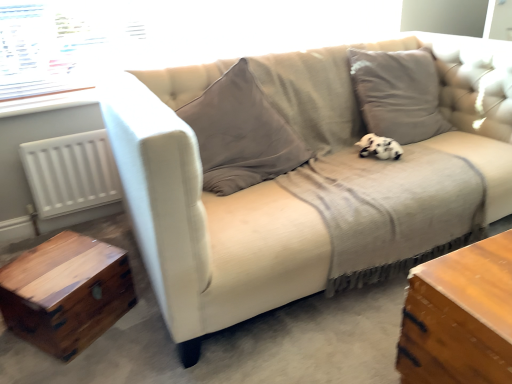
Question: Based on their sizes in the image, would you say transparent glass window at upper left is bigger or smaller than white matte radiator at left?

Choices:
 (A) small
 (B) big

Answer: (B)

Question: Is transparent glass window at upper left spatially inside white matte radiator at left, or outside of it?

Choices:
 (A) inside
 (B) outside

Answer: (B)

Question: Which object is positioned closest to the white matte radiator at left?

Choices:
 (A) wooden trunk at lower left
 (B) beige fabric couch at center
 (C) black and white plush at center
 (D) transparent glass window at upper left

Answer: (D)

Question: Which object is positioned closest to the black and white plush at center?

Choices:
 (A) white matte radiator at left
 (B) transparent glass window at upper left
 (C) wooden trunk at lower left
 (D) beige fabric couch at center

Answer: (D)